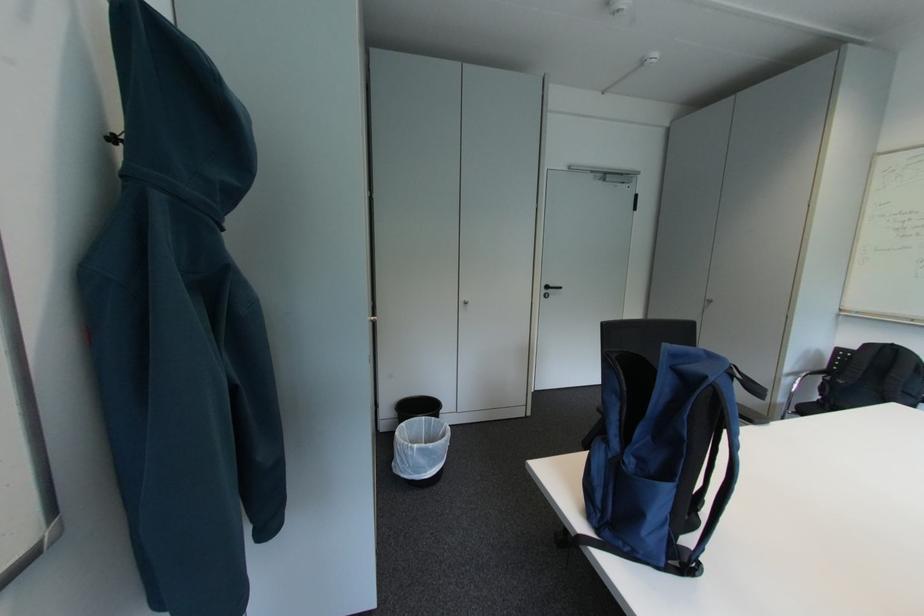
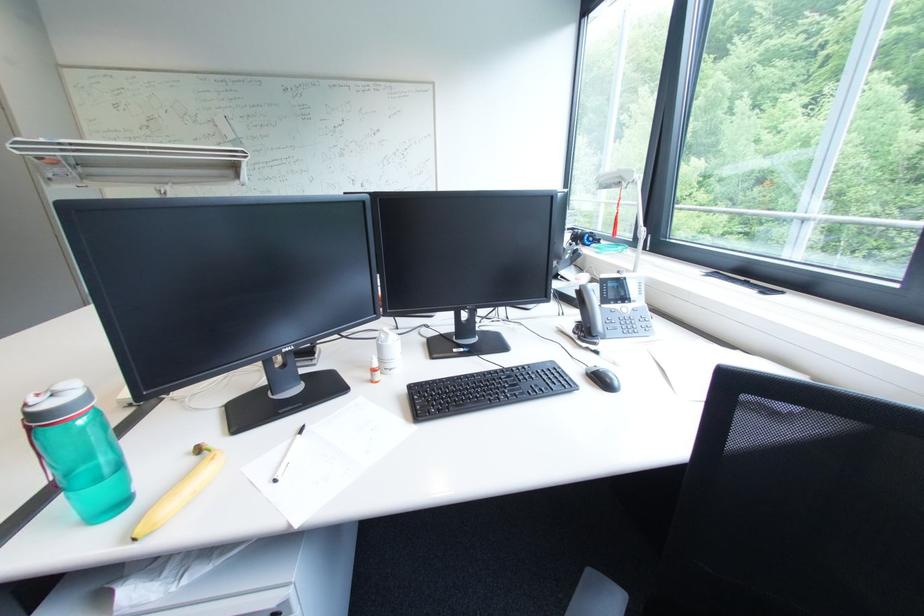
The first image is from the beginning of the video and the second image is from the end. How did the camera likely rotate when shooting the video?

The camera's rotation is toward right-down.